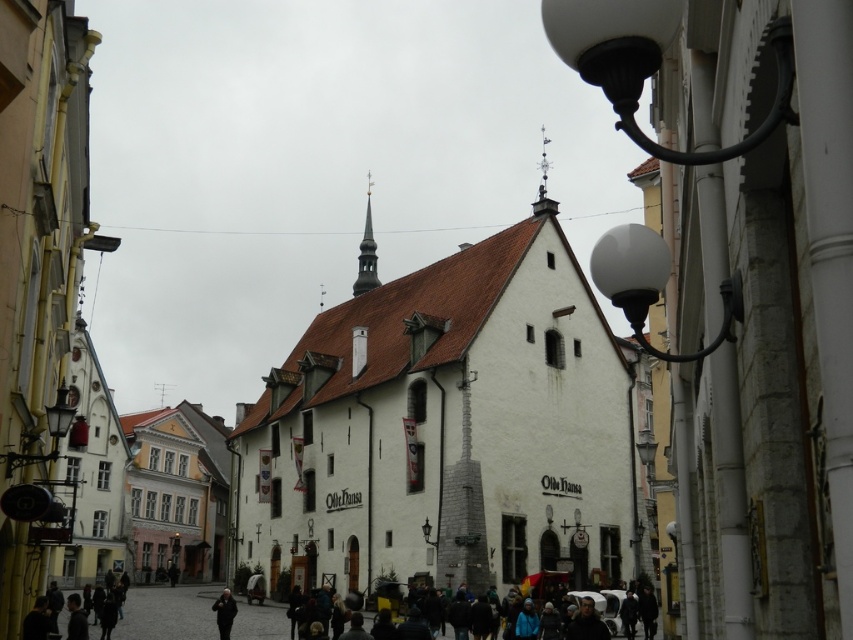
Question: Which object is closer to the camera taking this photo?

Choices:
 (A) black matte jacket at lower center
 (B) polished silver spire at center

Answer: (A)

Question: Which object is closer to the camera taking this photo?

Choices:
 (A) polished copper spire at center
 (B) polished silver spire at center

Answer: (B)

Question: Does white stone church at center come in front of polished copper spire at center?

Choices:
 (A) no
 (B) yes

Answer: (B)

Question: Does polished copper spire at center appear under polished silver spire at center?

Choices:
 (A) yes
 (B) no

Answer: (A)

Question: Considering the relative positions of polished copper spire at center and black matte jacket at lower center in the image provided, where is polished copper spire at center located with respect to black matte jacket at lower center?

Choices:
 (A) above
 (B) below

Answer: (A)

Question: Which of the following is the farthest from the observer?

Choices:
 (A) white stone church at center
 (B) black matte jacket at lower center

Answer: (A)